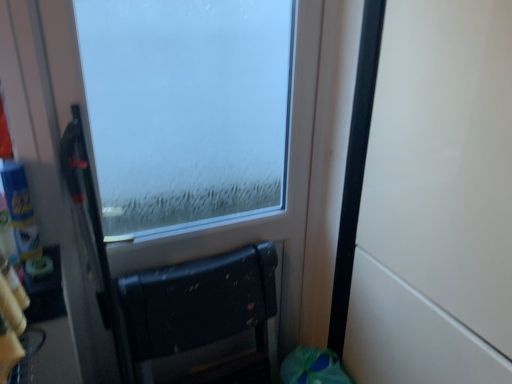
Question: Considering the relative positions of frosted glass window at center and black matte chair at lower center in the image provided, is frosted glass window at center to the left of black matte chair at lower center from the viewer's perspective?

Choices:
 (A) no
 (B) yes

Answer: (A)

Question: From a real-world perspective, is frosted glass window at center under black matte chair at lower center?

Choices:
 (A) yes
 (B) no

Answer: (B)

Question: Considering the relative positions of frosted glass window at center and black matte chair at lower center in the image provided, is frosted glass window at center to the right of black matte chair at lower center from the viewer's perspective?

Choices:
 (A) no
 (B) yes

Answer: (B)

Question: Is frosted glass window at center shorter than black matte chair at lower center?

Choices:
 (A) yes
 (B) no

Answer: (B)

Question: From a real-world perspective, is frosted glass window at center on top of black matte chair at lower center?

Choices:
 (A) no
 (B) yes

Answer: (B)

Question: Does frosted glass window at center contain black matte chair at lower center?

Choices:
 (A) yes
 (B) no

Answer: (A)

Question: From a real-world perspective, is white matte door at right on frosted glass window at center?

Choices:
 (A) no
 (B) yes

Answer: (A)

Question: Could you tell me if white matte door at right is facing frosted glass window at center?

Choices:
 (A) yes
 (B) no

Answer: (B)

Question: From a real-world perspective, is white matte door at right positioned under frosted glass window at center based on gravity?

Choices:
 (A) no
 (B) yes

Answer: (B)

Question: Is white matte door at right closer to the viewer compared to frosted glass window at center?

Choices:
 (A) yes
 (B) no

Answer: (A)

Question: Is white matte door at right far from frosted glass window at center?

Choices:
 (A) no
 (B) yes

Answer: (A)

Question: Is white matte door at right bigger than frosted glass window at center?

Choices:
 (A) no
 (B) yes

Answer: (B)

Question: Does black matte chair at lower center have a lesser width compared to frosted glass window at center?

Choices:
 (A) no
 (B) yes

Answer: (A)